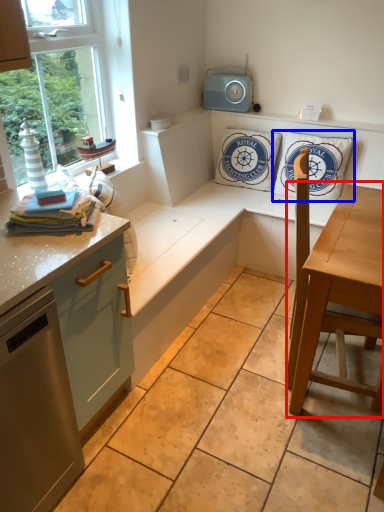
Question: Among these objects, which one is nearest to the camera, table (highlighted by a red box) or pillow (highlighted by a blue box)?

Choices:
 (A) table
 (B) pillow

Answer: (A)